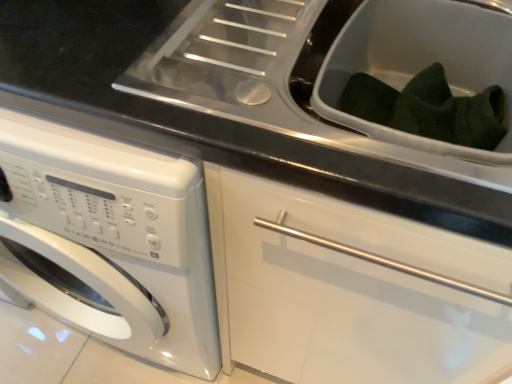
Question: Should I look upward or downward to see dark green fabric at upper right, which is the first sink from back to front?

Choices:
 (A) up
 (B) down

Answer: (A)

Question: Does white glossy washing machine at left have a lesser width compared to dark green fabric at upper right, which is the first sink from back to front?

Choices:
 (A) yes
 (B) no

Answer: (B)

Question: Does white glossy washing machine at left have a smaller size compared to dark green fabric at upper right, which is the first sink from back to front?

Choices:
 (A) no
 (B) yes

Answer: (A)

Question: Is white glossy washing machine at left completely or partially outside of dark green fabric at upper right, which is the first sink from back to front?

Choices:
 (A) yes
 (B) no

Answer: (A)

Question: Is white glossy washing machine at left further to camera compared to dark green fabric at upper right, which is the first sink from back to front?

Choices:
 (A) yes
 (B) no

Answer: (B)

Question: From a real-world perspective, is white glossy washing machine at left positioned over dark green fabric at upper right, which is the first sink from back to front, based on gravity?

Choices:
 (A) yes
 (B) no

Answer: (B)

Question: Can you confirm if white glossy washing machine at left is wider than dark green fabric at upper right, which is the second sink in front-to-back order?

Choices:
 (A) no
 (B) yes

Answer: (B)

Question: Is white plastic sink at center, acting as the 1th sink starting from the front, facing towards white glossy washing machine at left?

Choices:
 (A) no
 (B) yes

Answer: (A)

Question: Does white plastic sink at center, marked as the second sink in a back-to-front arrangement, have a greater width compared to white glossy washing machine at left?

Choices:
 (A) yes
 (B) no

Answer: (B)

Question: Considering the relative positions of white plastic sink at center, marked as the second sink in a back-to-front arrangement, and white glossy washing machine at left in the image provided, is white plastic sink at center, marked as the second sink in a back-to-front arrangement, to the left of white glossy washing machine at left from the viewer's perspective?

Choices:
 (A) no
 (B) yes

Answer: (A)

Question: Can you confirm if white plastic sink at center, marked as the second sink in a back-to-front arrangement, is thinner than white glossy washing machine at left?

Choices:
 (A) no
 (B) yes

Answer: (B)

Question: Is white plastic sink at center, acting as the 1th sink starting from the front, positioned behind white glossy washing machine at left?

Choices:
 (A) no
 (B) yes

Answer: (A)

Question: Is white plastic sink at center, marked as the second sink in a back-to-front arrangement, positioned beyond the bounds of white glossy washing machine at left?

Choices:
 (A) no
 (B) yes

Answer: (B)

Question: Considering the relative sizes of dark green fabric at upper right, which is the second sink in front-to-back order, and white glossy washing machine at left in the image provided, is dark green fabric at upper right, which is the second sink in front-to-back order, taller than white glossy washing machine at left?

Choices:
 (A) no
 (B) yes

Answer: (A)